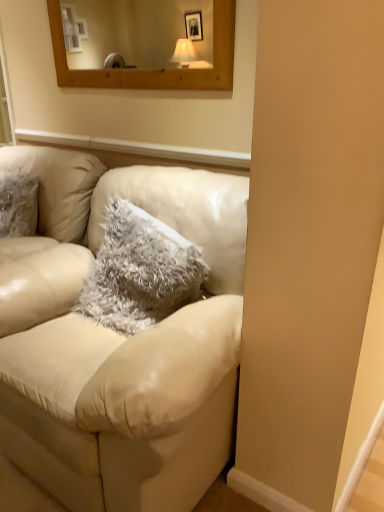
Question: From a real-world perspective, is fuzzy gray pillow at center physically located above or below matte cream leather couch at center?

Choices:
 (A) above
 (B) below

Answer: (A)

Question: In terms of height, does fuzzy gray pillow at center look taller or shorter compared to matte cream leather couch at center?

Choices:
 (A) tall
 (B) short

Answer: (B)

Question: Relative to matte cream leather couch at center, is fuzzy gray pillow at center in front or behind?

Choices:
 (A) behind
 (B) front

Answer: (A)

Question: From a real-world perspective, is matte cream leather couch at center physically located above or below fuzzy gray pillow at center?

Choices:
 (A) below
 (B) above

Answer: (A)

Question: In the image, is matte cream leather couch at center positioned in front of or behind fuzzy gray pillow at center?

Choices:
 (A) front
 (B) behind

Answer: (A)

Question: Is point (16, 160) positioned closer to the camera than point (117, 329)?

Choices:
 (A) closer
 (B) farther

Answer: (B)

Question: In terms of size, does matte cream leather couch at center appear bigger or smaller than fuzzy gray pillow at center?

Choices:
 (A) big
 (B) small

Answer: (A)